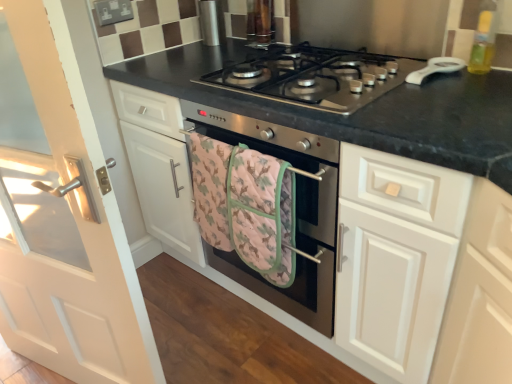
Measure the distance between point (301, 55) and camera.

Point (301, 55) is 4.73 feet from camera.

What do you see at coordinates (362, 110) in the screenshot? The width and height of the screenshot is (512, 384). I see `black granite countertop at center` at bounding box center [362, 110].

In order to click on pink quilted towel at center in this screenshot , I will do `click(245, 205)`.

Is black granite countertop at center turned away from pink quilted towel at center?

Yes.

What's the angular difference between black granite countertop at center and pink quilted towel at center's facing directions?

There is a 2.45-degree angle between the facing directions of black granite countertop at center and pink quilted towel at center.

Is black granite countertop at center positioned before pink quilted towel at center?

Yes, it is in front of pink quilted towel at center.

Does point (402, 149) lie in front of point (275, 285)?

Yes, point (402, 149) is in front of point (275, 285).

Is white glossy door at left positioned behind pink quilted towel at center?

No, it is not.

Considering the relative positions of white glossy door at left and pink quilted towel at center in the image provided, is white glossy door at left to the right of pink quilted towel at center from the viewer's perspective?

In fact, white glossy door at left is to the left of pink quilted towel at center.

Consider the image. From the image's perspective, which is below, white glossy door at left or pink quilted towel at center?

white glossy door at left appears lower in the image.

Considering the sizes of white glossy door at left and pink quilted towel at center in the image, is white glossy door at left wider or thinner than pink quilted towel at center?

white glossy door at left is thinner than pink quilted towel at center.

Is stainless steel oven at center taller or shorter than pink quilted towel at center?

In the image, stainless steel oven at center appears to be taller than pink quilted towel at center.

You are a GUI agent. You are given a task and a screenshot of the screen. Output one action in this format:
    pyautogui.click(x=<x>, y=<y>)
    Task: Click on the oven on the right of pink quilted towel at center
    The width and height of the screenshot is (512, 384).
    Given the screenshot: What is the action you would take?
    pyautogui.click(x=296, y=211)

Is stainless steel oven at center inside the boundaries of pink quilted towel at center, or outside?

stainless steel oven at center is located beyond the bounds of pink quilted towel at center.

Measure the distance between stainless steel oven at center and pink quilted towel at center.

stainless steel oven at center and pink quilted towel at center are 3.85 inches apart.

From a real-world perspective, between pink quilted towel at center and black granite countertop at center, who is vertically higher?

In real-world perspective, pink quilted towel at center is above.

From the image's perspective, who appears lower, pink quilted towel at center or black granite countertop at center?

pink quilted towel at center appears lower in the image.

Is there a large distance between pink quilted towel at center and black granite countertop at center?

That's not correct — pink quilted towel at center is a little close to black granite countertop at center.

Is black granite countertop at center at the back of pink quilted towel at center?

Absolutely, pink quilted towel at center is directed away from black granite countertop at center.

Choose the correct answer: Is stainless steel oven at center inside white glossy door at left or outside it?

stainless steel oven at center is outside white glossy door at left.

Based on their positions, is stainless steel oven at center located to the left or right of white glossy door at left?

Based on their positions, stainless steel oven at center is located to the right of white glossy door at left.

Considering the relative sizes of stainless steel oven at center and white glossy door at left in the image provided, is stainless steel oven at center taller than white glossy door at left?

No, stainless steel oven at center is not taller than white glossy door at left.

From a real-world perspective, is stainless steel oven at center under white glossy door at left?

Indeed, from a real-world perspective, stainless steel oven at center is positioned beneath white glossy door at left.

Which of these two, white glossy door at left or stainless steel oven at center, is wider?

With larger width is stainless steel oven at center.

Which is in front, point (88, 184) or point (325, 139)?

The point (88, 184) is in front.

Who is shorter, white glossy door at left or stainless steel oven at center?

With less height is stainless steel oven at center.

Looking at this image, is white glossy door at left situated inside stainless steel oven at center or outside?

white glossy door at left is not inside stainless steel oven at center, it's outside.

From the image's perspective, relative to pink quilted towel at center, is stainless steel gas stove at center above or below?

stainless steel gas stove at center is above pink quilted towel at center.

Is stainless steel gas stove at center situated inside pink quilted towel at center or outside?

stainless steel gas stove at center cannot be found inside pink quilted towel at center.

Considering the sizes of stainless steel gas stove at center and pink quilted towel at center in the image, is stainless steel gas stove at center taller or shorter than pink quilted towel at center?

stainless steel gas stove at center is shorter than pink quilted towel at center.

Does stainless steel gas stove at center have a greater width compared to pink quilted towel at center?

Indeed, stainless steel gas stove at center has a greater width compared to pink quilted towel at center.

Locate an element on the screen. beach towel that is behind the black granite countertop at center is located at coordinates (245, 205).

Find the location of a particular element. The image size is (512, 384). door that appears below the pink quilted towel at center (from the image's perspective) is located at coordinates (78, 229).

Considering their positions, is white glossy door at left positioned further to stainless steel gas stove at center than black granite countertop at center?

Among the two, white glossy door at left is located further to stainless steel gas stove at center.

Which object lies nearer to the anchor point stainless steel oven at center, stainless steel gas stove at center or black granite countertop at center?

black granite countertop at center lies closer to stainless steel oven at center than the other object.

Based on the photo, based on their spatial positions, is white glossy door at left or stainless steel oven at center further from pink quilted towel at center?

The object further to pink quilted towel at center is white glossy door at left.

Considering their positions, is pink quilted towel at center positioned further to stainless steel oven at center than stainless steel gas stove at center?

Among the two, stainless steel gas stove at center is located further to stainless steel oven at center.

From the image, which object appears to be nearer to white glossy door at left, stainless steel gas stove at center or stainless steel oven at center?

stainless steel oven at center.

From the picture: Estimate the real-world distances between objects in this image. Which object is further from stainless steel oven at center, pink quilted towel at center or white glossy door at left?

The object further to stainless steel oven at center is white glossy door at left.

From the image, which object appears to be nearer to black granite countertop at center, stainless steel gas stove at center or pink quilted towel at center?

stainless steel gas stove at center is closer to black granite countertop at center.

Considering their positions, is white glossy door at left positioned further to stainless steel oven at center than black granite countertop at center?

white glossy door at left lies further to stainless steel oven at center than the other object.

Image resolution: width=512 pixels, height=384 pixels. Identify the location of gas stove situated between white glossy door at left and black granite countertop at center from left to right. (314, 76).

Where is `oven between black granite countertop at center and pink quilted towel at center from front to back`? The height and width of the screenshot is (384, 512). oven between black granite countertop at center and pink quilted towel at center from front to back is located at coordinates (296, 211).

This screenshot has width=512, height=384. I want to click on beach towel between white glossy door at left and black granite countertop at center in the horizontal direction, so click(x=245, y=205).

At what (x,y) coordinates should I click in order to perform the action: click on beach towel between white glossy door at left and stainless steel oven at center. Please return your answer as a coordinate pair (x, y). Looking at the image, I should click on (245, 205).